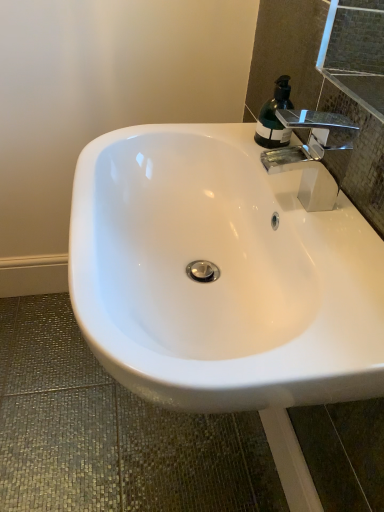
Question: Does white glossy sink at center have a greater height compared to translucent green bottle at upper right?

Choices:
 (A) no
 (B) yes

Answer: (B)

Question: Is there a large distance between white glossy sink at center and translucent green bottle at upper right?

Choices:
 (A) yes
 (B) no

Answer: (B)

Question: Is white glossy sink at center bigger than translucent green bottle at upper right?

Choices:
 (A) yes
 (B) no

Answer: (A)

Question: Is white glossy sink at center facing away from translucent green bottle at upper right?

Choices:
 (A) no
 (B) yes

Answer: (A)

Question: Can you confirm if white glossy sink at center is smaller than translucent green bottle at upper right?

Choices:
 (A) yes
 (B) no

Answer: (B)

Question: Is white glossy sink at center located outside translucent green bottle at upper right?

Choices:
 (A) yes
 (B) no

Answer: (A)

Question: Are translucent green bottle at upper right and white glossy sink at center located far from each other?

Choices:
 (A) yes
 (B) no

Answer: (B)

Question: Is translucent green bottle at upper right not inside white glossy sink at center?

Choices:
 (A) no
 (B) yes

Answer: (B)

Question: Can you confirm if translucent green bottle at upper right is positioned to the right of white glossy sink at center?

Choices:
 (A) yes
 (B) no

Answer: (A)

Question: Is translucent green bottle at upper right wider than white glossy sink at center?

Choices:
 (A) yes
 (B) no

Answer: (B)

Question: Is translucent green bottle at upper right facing towards white glossy sink at center?

Choices:
 (A) no
 (B) yes

Answer: (A)

Question: Considering the relative sizes of translucent green bottle at upper right and white glossy sink at center in the image provided, is translucent green bottle at upper right shorter than white glossy sink at center?

Choices:
 (A) no
 (B) yes

Answer: (B)

Question: From the image's perspective, does chrome/metallic faucet at upper right appear lower than white glossy sink at center?

Choices:
 (A) yes
 (B) no

Answer: (B)